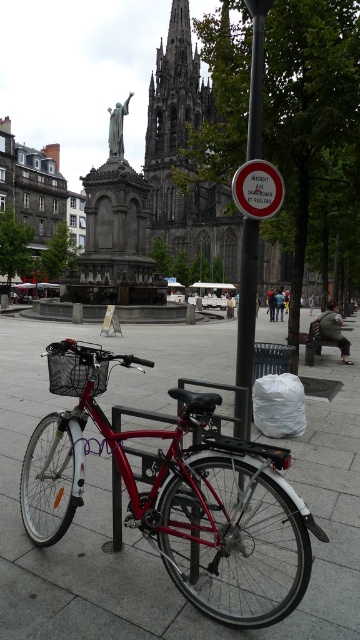
Question: In this image, where is metallic pole at center located relative to white paper sign at center?

Choices:
 (A) below
 (B) above

Answer: (B)

Question: Does white paper sign at center have a larger size compared to matte black basket at center?

Choices:
 (A) yes
 (B) no

Answer: (B)

Question: Which point is farther from the camera taking this photo?

Choices:
 (A) (145, 364)
 (B) (48, 348)
 (C) (237, 417)

Answer: (A)

Question: Which point appears closest to the camera in this image?

Choices:
 (A) (162, 477)
 (B) (253, 93)

Answer: (A)

Question: Is metallic pole at center below matte black basket at center?

Choices:
 (A) no
 (B) yes

Answer: (A)

Question: Which of the following is the closest to the observer?

Choices:
 (A) white paper sign at center
 (B) matte black basket at center
 (C) shiny metallic bicycle at center

Answer: (C)